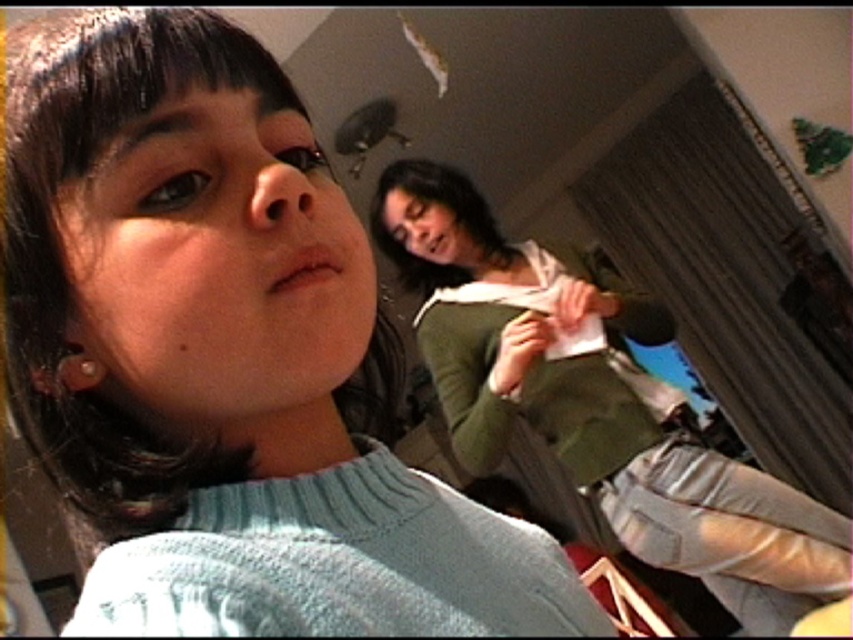
Who is more forward, (28,225) or (619,321)?

Point (28,225) is more forward.

Can you confirm if light blue sweater at upper left is positioned above green matte sweater at upper right?

Correct, light blue sweater at upper left is located above green matte sweater at upper right.

Locate an element on the screen. The width and height of the screenshot is (853, 640). light blue sweater at upper left is located at coordinates (223, 356).